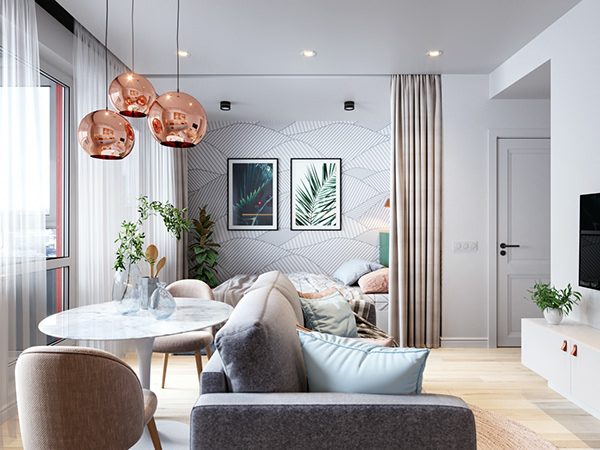
Image resolution: width=600 pixels, height=450 pixels. Identify the location of flat screen tv. (577, 252).